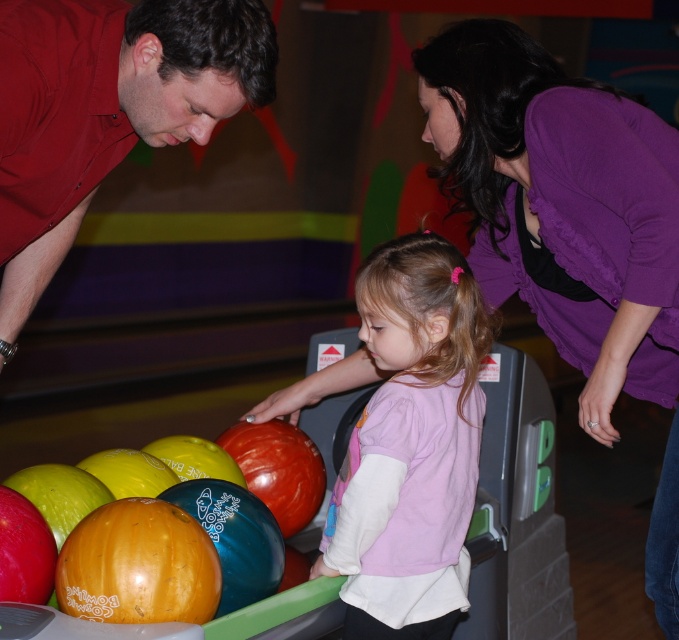
You are standing at the entrance of the bowling alley and see the purple fabric shirt at upper right and the pink fabric shirt at center. Which shirt is closer to you?

The purple fabric shirt at upper right is closer to you because it is in front of the pink fabric shirt at center.

You are a photographer trying to capture a closeup of the purple fabric shirt at upper right and the pink fabric shirt at center. Since you want both shirts to be in focus, which one should you adjust your camera focus towards?

You should focus on the purple fabric shirt at upper right because it is larger in size than the pink fabric shirt at center, meaning it is closer to the camera.

You are standing at the entrance of the bowling alley and see the purple fabric shirt at upper right and the pink fabric shirt at center. Which one is positioned more to the right side?

The purple fabric shirt at upper right is positioned more to the right side than the pink fabric shirt at center.